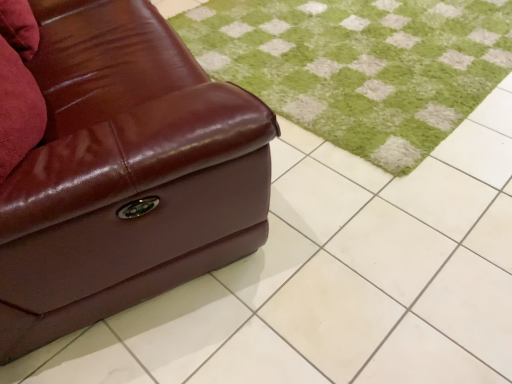
Question: Is brown leather couch at left wider or thinner than green soft rug at center?

Choices:
 (A) thin
 (B) wide

Answer: (A)

Question: Considering the positions of brown leather couch at left and green soft rug at center in the image, is brown leather couch at left bigger or smaller than green soft rug at center?

Choices:
 (A) small
 (B) big

Answer: (B)

Question: Would you say brown leather couch at left is to the left or to the right of green soft rug at center in the picture?

Choices:
 (A) left
 (B) right

Answer: (A)

Question: From a real-world perspective, is green soft rug at center positioned above or below brown leather couch at left?

Choices:
 (A) below
 (B) above

Answer: (A)

Question: Does point (302, 122) appear closer or farther from the camera than point (224, 218)?

Choices:
 (A) farther
 (B) closer

Answer: (A)

Question: From the image's perspective, is green soft rug at center located above or below brown leather couch at left?

Choices:
 (A) above
 (B) below

Answer: (A)

Question: In terms of width, does green soft rug at center look wider or thinner when compared to brown leather couch at left?

Choices:
 (A) wide
 (B) thin

Answer: (A)